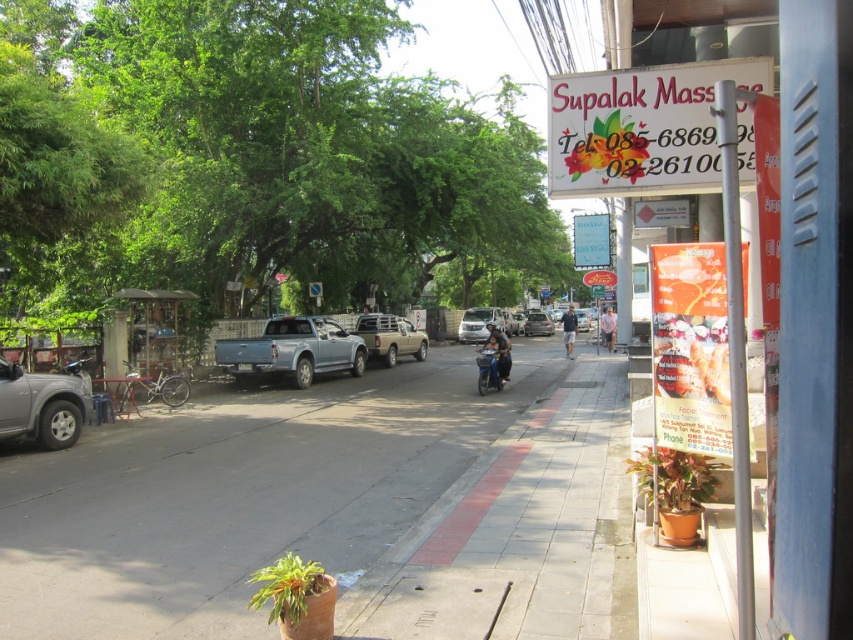
Who is taller, white plastic sign at upper right or metallic silver motorcycle at center?

white plastic sign at upper right

Is white plastic sign at upper right smaller than metallic silver motorcycle at center?

No.

Between point (583, 74) and point (498, 368), which one is positioned behind?

Positioned behind is point (498, 368).

The height and width of the screenshot is (640, 853). I want to click on white plastic sign at upper right, so click(641, 128).

Does green leafy tree at upper center come behind satin silver car at center?

No, it is not.

Can you confirm if green leafy tree at upper center is positioned above satin silver car at center?

Yes, green leafy tree at upper center is above satin silver car at center.

The width and height of the screenshot is (853, 640). What do you see at coordinates (251, 157) in the screenshot? I see `green leafy tree at upper center` at bounding box center [251, 157].

The height and width of the screenshot is (640, 853). What are the coordinates of `green leafy tree at upper center` in the screenshot? It's located at (251, 157).

Is white plastic sign at upper right positioned in front of silver metallic suv at left?

Yes, white plastic sign at upper right is in front of silver metallic suv at left.

Measure the distance between white plastic sign at upper right and silver metallic suv at left.

The distance of white plastic sign at upper right from silver metallic suv at left is 8.65 meters.

Between point (556, 177) and point (35, 384), which one is positioned behind?

Positioned behind is point (35, 384).

At what (x,y) coordinates should I click in order to perform the action: click on white plastic sign at upper right. Please return your answer as a coordinate pair (x, y). This screenshot has width=853, height=640. Looking at the image, I should click on (641, 128).